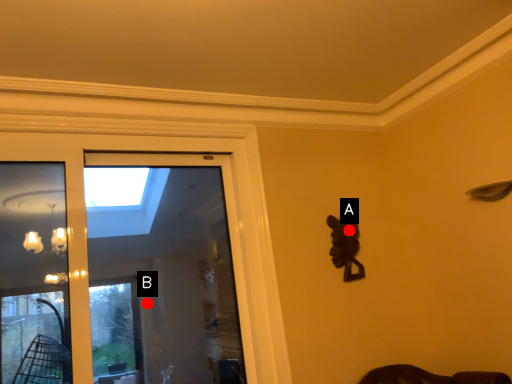
Question: Two points are circled on the image, labeled by A and B beside each circle. Which of the following is the farthest from the observer?

Choices:
 (A) A is further
 (B) B is further

Answer: (B)